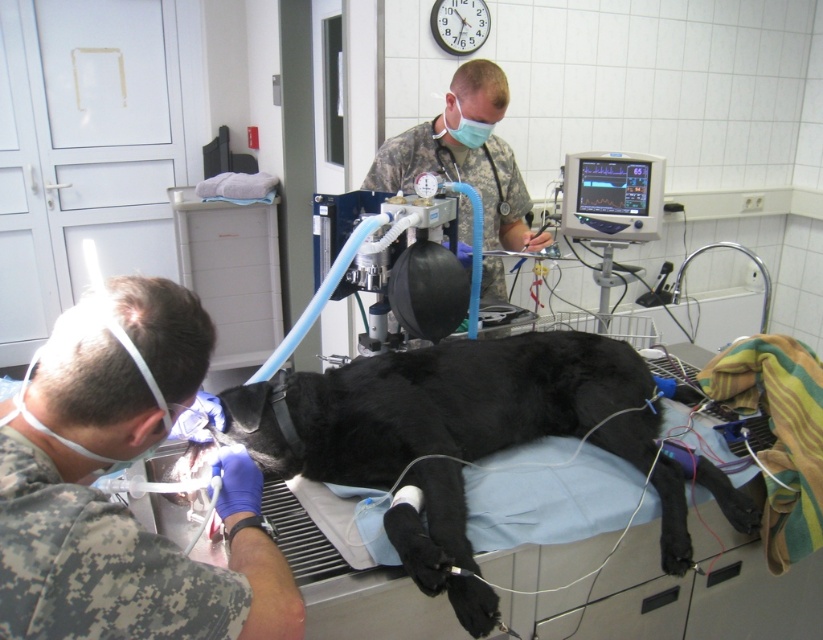
Between point (610, 417) and point (394, 188), which one is positioned behind?

The point (394, 188) is more distant.

Between black fur dog at center and camouflage uniform at center, which one is positioned lower?

black fur dog at center

This screenshot has width=823, height=640. What do you see at coordinates (458, 436) in the screenshot?
I see `black fur dog at center` at bounding box center [458, 436].

Find the location of a particular element. This screenshot has width=823, height=640. black fur dog at center is located at coordinates (458, 436).

In the scene shown: Can you confirm if black fur dog at center is positioned to the right of blue fabric mask at upper center?

Correct, you'll find black fur dog at center to the right of blue fabric mask at upper center.

Who is shorter, black fur dog at center or blue fabric mask at upper center?

blue fabric mask at upper center is shorter.

This screenshot has width=823, height=640. Identify the location of black fur dog at center. (458, 436).

Locate an element on the screen. The width and height of the screenshot is (823, 640). black fur dog at center is located at coordinates (458, 436).

Is camouflage fabric at left taller than black fur dog at center?

No, camouflage fabric at left is not taller than black fur dog at center.

What do you see at coordinates (112, 515) in the screenshot? I see `camouflage fabric at left` at bounding box center [112, 515].

The width and height of the screenshot is (823, 640). In order to click on camouflage fabric at left in this screenshot , I will do `click(112, 515)`.